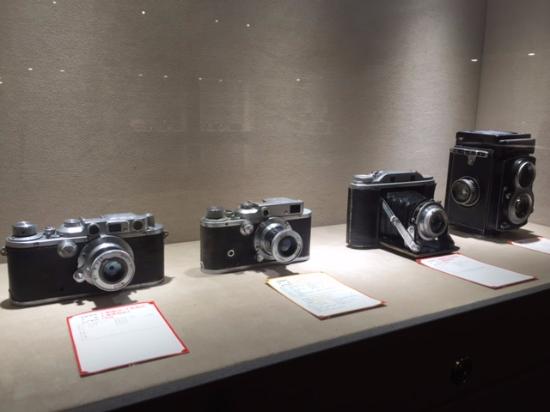
The height and width of the screenshot is (412, 550). Identify the location of display case background. (152, 92), (382, 83), (509, 76).